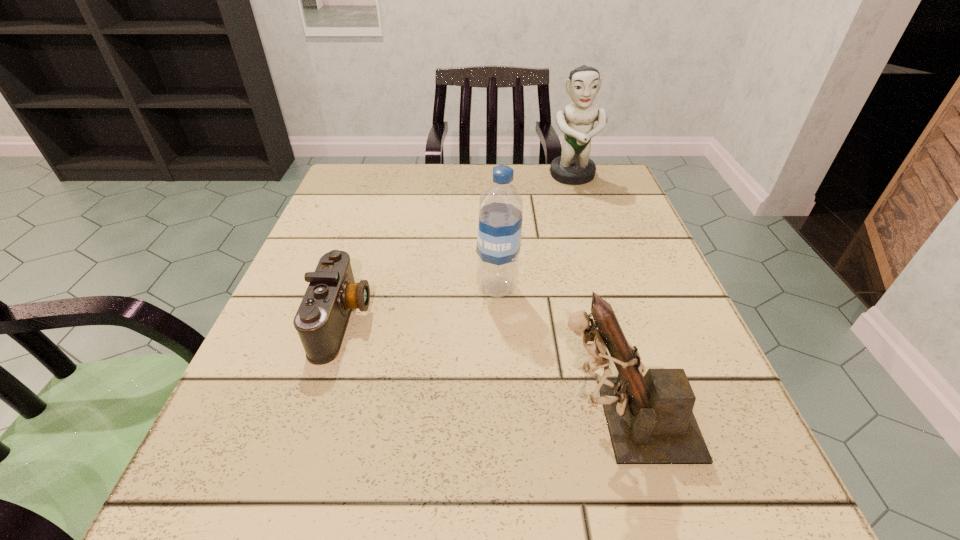
Identify the location of vacant region at the left edge of the desktop. This screenshot has width=960, height=540. (273, 455).

Identify the location of vacant region at the far left corner of the desktop. (352, 170).

You are a GUI agent. You are given a task and a screenshot of the screen. Output one action in this format:
    pyautogui.click(x=<x>, y=<y>)
    Task: Click on the vacant space at the near left corner of the desktop
    This screenshot has width=960, height=540.
    Given the screenshot: What is the action you would take?
    click(302, 482)

Find the location of a particular element. This screenshot has width=960, height=540. free point at the far right corner is located at coordinates (565, 213).

Find the location of a particular element. blank region between the farthest object and the leftmost object is located at coordinates (458, 248).

Locate an element on the screen. The width and height of the screenshot is (960, 540). vacant area that lies between the farther figurine and the water bottle is located at coordinates (535, 232).

The image size is (960, 540). In order to click on vacant area between the water bottle and the leftmost object in this screenshot , I will do pyautogui.click(x=420, y=304).

The image size is (960, 540). Find the location of `free spot between the second object from left to right and the nearest object`. free spot between the second object from left to right and the nearest object is located at coordinates (560, 354).

I want to click on vacant space that's between the farther figurine and the shortest object, so click(x=458, y=248).

Identify the location of vacant space that's between the leftmost object and the water bottle. (420, 304).